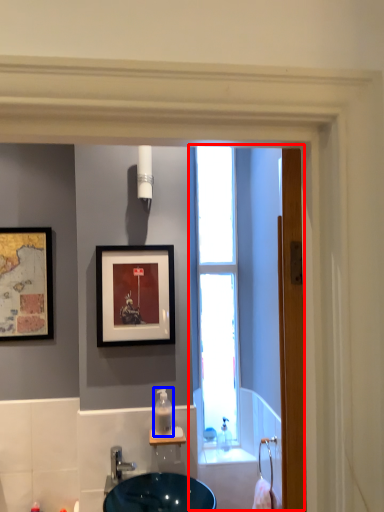
Question: Among these objects, which one is farthest to the camera, screen door (highlighted by a red box) or soap dispenser (highlighted by a blue box)?

Choices:
 (A) screen door
 (B) soap dispenser

Answer: (B)